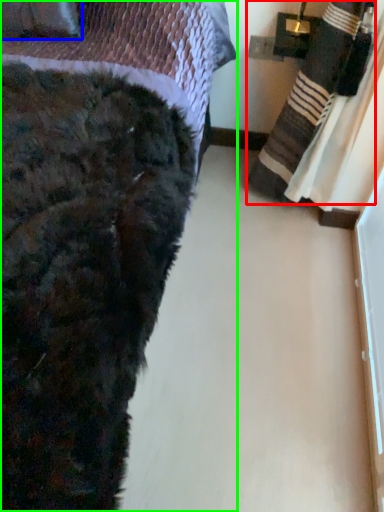
Question: Which object is positioned closest to blanket (highlighted by a red box)? Select from throw pillow (highlighted by a blue box) and bed (highlighted by a green box).

Choices:
 (A) throw pillow
 (B) bed

Answer: (B)